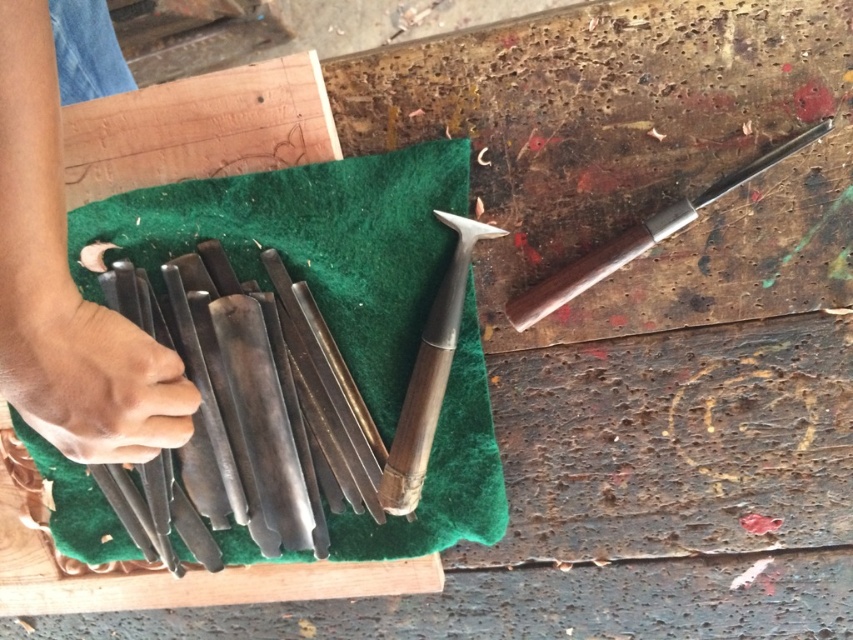
Question: Which of the following is the closest to the observer?

Choices:
 (A) dark brown wood at left
 (B) polished metal knife at center
 (C) dark skin hand at lower left
 (D) wooden chisel at right

Answer: (C)

Question: Is wooden handle chisel at center to the left of wooden chisel at right from the viewer's perspective?

Choices:
 (A) no
 (B) yes

Answer: (B)

Question: Which point is farther from the camera taking this photo?

Choices:
 (A) (357, 365)
 (B) (589, 278)
 (C) (317, 520)
 (D) (416, 448)

Answer: (C)

Question: Does dark brown wood at left have a greater width compared to wooden handle chisel at center?

Choices:
 (A) no
 (B) yes

Answer: (B)

Question: Is the position of green felt at center less distant than that of dark brown wood at left?

Choices:
 (A) no
 (B) yes

Answer: (A)

Question: Which point appears closest to the camera in this image?

Choices:
 (A) (90, 108)
 (B) (445, 273)
 (C) (10, 54)
 (D) (82, 324)

Answer: (C)